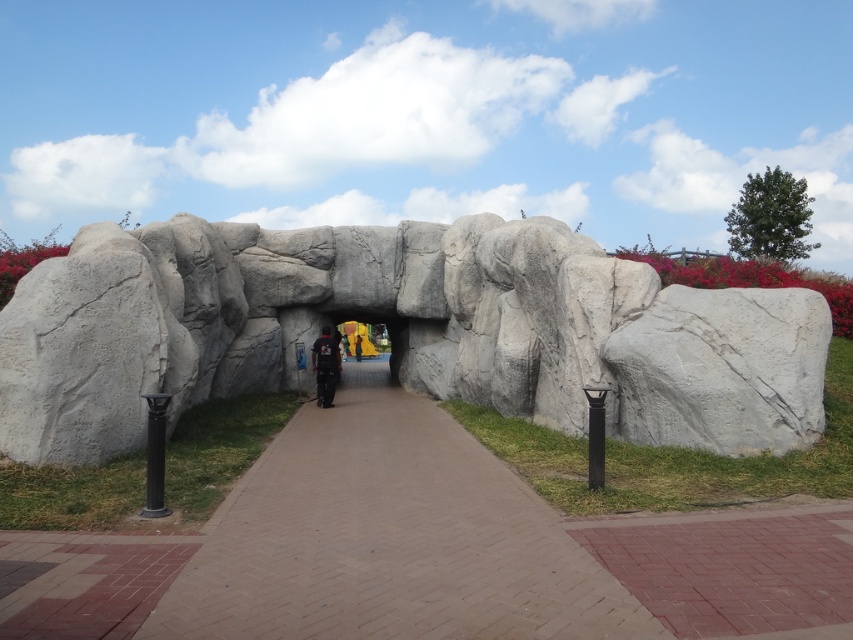
Question: Which object is farther from the camera taking this photo?

Choices:
 (A) black matte jacket at center
 (B) white stone archway at center
 (C) gray rough boulder at right

Answer: (A)

Question: Is white stone archway at center positioned behind black matte jacket at center?

Choices:
 (A) yes
 (B) no

Answer: (B)

Question: Considering the relative positions of gray rough boulder at right and black matte jacket at center in the image provided, where is gray rough boulder at right located with respect to black matte jacket at center?

Choices:
 (A) right
 (B) left

Answer: (A)

Question: Is white stone archway at center positioned before black matte jacket at center?

Choices:
 (A) yes
 (B) no

Answer: (A)

Question: Which of the following is the closest to the observer?

Choices:
 (A) (666, 417)
 (B) (381, 419)
 (C) (480, 316)
 (D) (325, 364)

Answer: (A)

Question: Estimate the real-world distances between objects in this image. Which object is farther from the gray rough boulder at right?

Choices:
 (A) black matte jacket at center
 (B) white stone archway at center

Answer: (A)